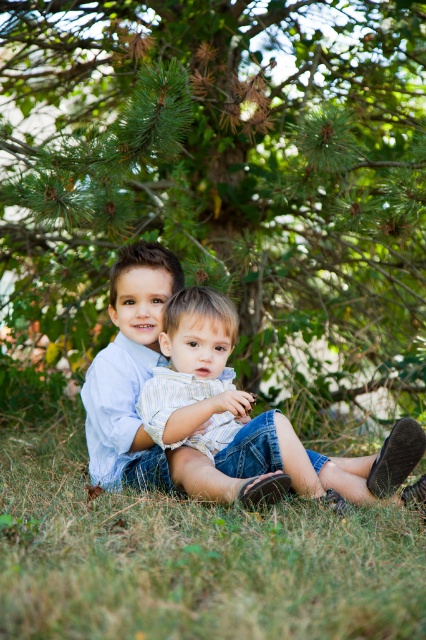
From the picture: You are a photographer trying to capture the two boys under the green textured pine tree at upper center. To ensure the tree is centered in your photo, where should you position the camera relative to the boys?

The green textured pine tree at upper center is located at coordinate point (221,173), so you should position the camera slightly to the left and lower the angle to center the tree in the frame.

You are a photographer taking a picture of the two boys. You want to ensure the striped cotton shirt at center is visible in the frame. Should you adjust your camera angle to the left or right of the green grass at lower center?

The green grass at lower center is to the left of the striped cotton shirt at center, so to ensure the striped cotton shirt at center is visible, you should position your camera to the right of the green grass at lower center.

Looking at this image, you are a photographer standing at the camera position. You want to take a photo of the two boys but need to ensure the green textured pine tree at upper center does not block the view. What is the minimum distance you should move forward to keep both boys in frame while avoiding the tree?

The green textured pine tree at upper center is 3.05 meters from the camera. To avoid blocking the view, move forward until you are closer than 3.05 meters, ensuring the tree is no longer in the frame while keeping the boys visible.